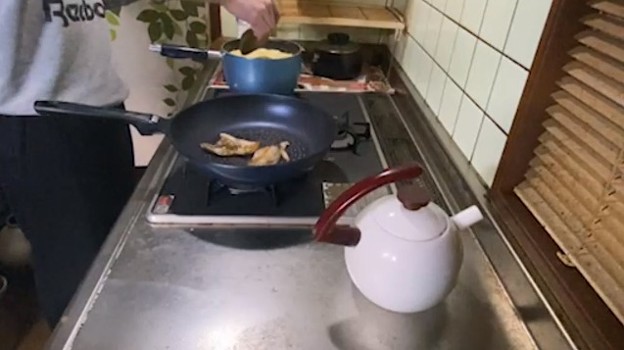
The width and height of the screenshot is (624, 350). Find the location of `wall`. wall is located at coordinates (515, 50), (230, 31).